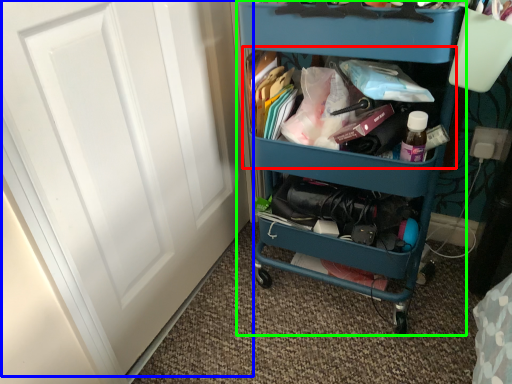
Question: Which object is positioned farthest from cabinet (highlighted by a red box)? Select from door (highlighted by a blue box) and furniture (highlighted by a green box).

Choices:
 (A) door
 (B) furniture

Answer: (A)